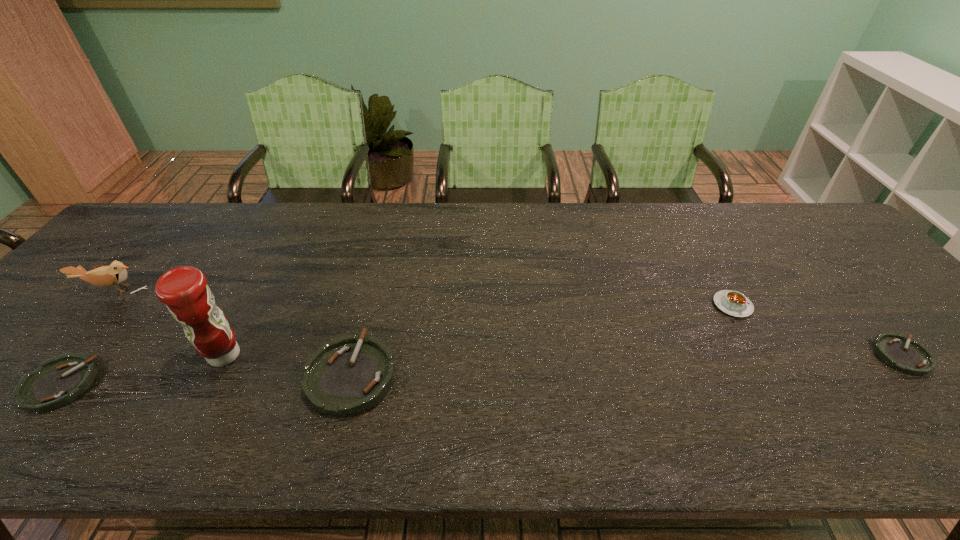
The width and height of the screenshot is (960, 540). What are the coordinates of `vacant space that satisfies the following two spatial constraints: 1. at the beak of the fifth shortest object; 2. on the left side of the second shortest ashtray` in the screenshot? It's located at pos(30,384).

The width and height of the screenshot is (960, 540). What are the coordinates of `free space in the image that satisfies the following two spatial constraints: 1. on the back side of the second shortest ashtray; 2. on the left side of the pudding` in the screenshot? It's located at (124, 305).

Where is `blank area in the image that satisfies the following two spatial constraints: 1. at the beak of the second shortest ashtray; 2. on the right side of the fifth shortest object`? blank area in the image that satisfies the following two spatial constraints: 1. at the beak of the second shortest ashtray; 2. on the right side of the fifth shortest object is located at coordinates (30, 384).